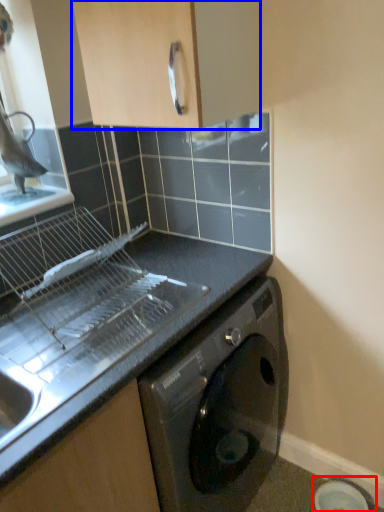
Question: Among these objects, which one is nearest to the camera, appliance (highlighted by a red box) or cabinetry (highlighted by a blue box)?

Choices:
 (A) appliance
 (B) cabinetry

Answer: (B)